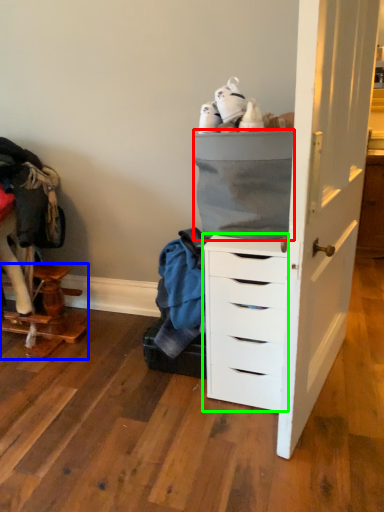
Question: Considering the real-world distances, which object is closest to cabinetry (highlighted by a red box)? furniture (highlighted by a blue box) or chest of drawers (highlighted by a green box).

Choices:
 (A) furniture
 (B) chest of drawers

Answer: (B)